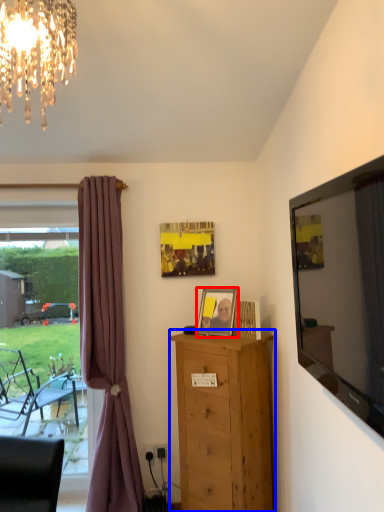
Question: Among these objects, which one is farthest to the camera, picture frame (highlighted by a red box) or chest of drawers (highlighted by a blue box)?

Choices:
 (A) picture frame
 (B) chest of drawers

Answer: (A)